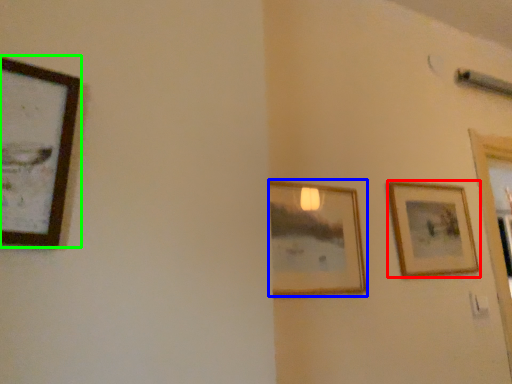
Question: Which object is positioned farthest from picture frame (highlighted by a red box)? Select from picture frame (highlighted by a blue box) and picture frame (highlighted by a green box).

Choices:
 (A) picture frame
 (B) picture frame

Answer: (B)